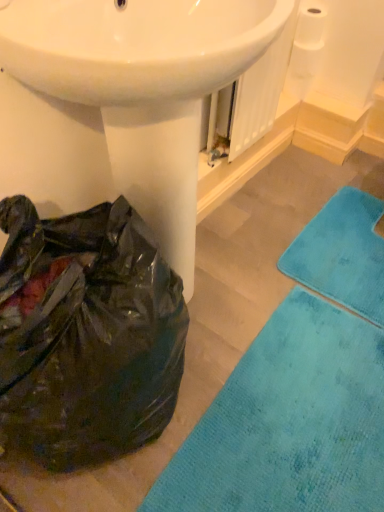
Question: From a real-world perspective, is white matte toilet paper at upper right physically above teal soft rug at lower right?

Choices:
 (A) yes
 (B) no

Answer: (A)

Question: From the image's perspective, does white matte toilet paper at upper right appear lower than teal soft rug at lower right?

Choices:
 (A) no
 (B) yes

Answer: (A)

Question: Considering the relative sizes of white matte toilet paper at upper right and teal soft rug at lower right in the image provided, is white matte toilet paper at upper right shorter than teal soft rug at lower right?

Choices:
 (A) yes
 (B) no

Answer: (B)

Question: Is white matte toilet paper at upper right completely or partially outside of teal soft rug at lower right?

Choices:
 (A) no
 (B) yes

Answer: (B)

Question: Does white matte toilet paper at upper right have a greater height compared to teal soft rug at lower right?

Choices:
 (A) yes
 (B) no

Answer: (A)

Question: Is point (223, 408) positioned closer to the camera than point (122, 7)?

Choices:
 (A) farther
 (B) closer

Answer: (A)

Question: From the image's perspective, relative to white glossy sink at center, is teal soft rug at lower right above or below?

Choices:
 (A) below
 (B) above

Answer: (A)

Question: Looking at the image, does teal soft rug at lower right seem bigger or smaller compared to white glossy sink at center?

Choices:
 (A) small
 (B) big

Answer: (A)

Question: Based on their positions, is teal soft rug at lower right located to the left or right of white glossy sink at center?

Choices:
 (A) right
 (B) left

Answer: (A)

Question: Do you think white matte toilet paper at upper right is within white glossy sink at center, or outside of it?

Choices:
 (A) outside
 (B) inside

Answer: (A)

Question: Is white matte toilet paper at upper right wider or thinner than white glossy sink at center?

Choices:
 (A) wide
 (B) thin

Answer: (B)

Question: From a real-world perspective, is white matte toilet paper at upper right above or below white glossy sink at center?

Choices:
 (A) below
 (B) above

Answer: (B)

Question: From the image's perspective, relative to white glossy sink at center, is white matte toilet paper at upper right above or below?

Choices:
 (A) below
 (B) above

Answer: (B)

Question: Considering their positions, is white glossy sink at center located in front of or behind teal plush bath towel at lower right?

Choices:
 (A) front
 (B) behind

Answer: (A)

Question: In terms of width, does white glossy sink at center look wider or thinner when compared to teal plush bath towel at lower right?

Choices:
 (A) thin
 (B) wide

Answer: (A)